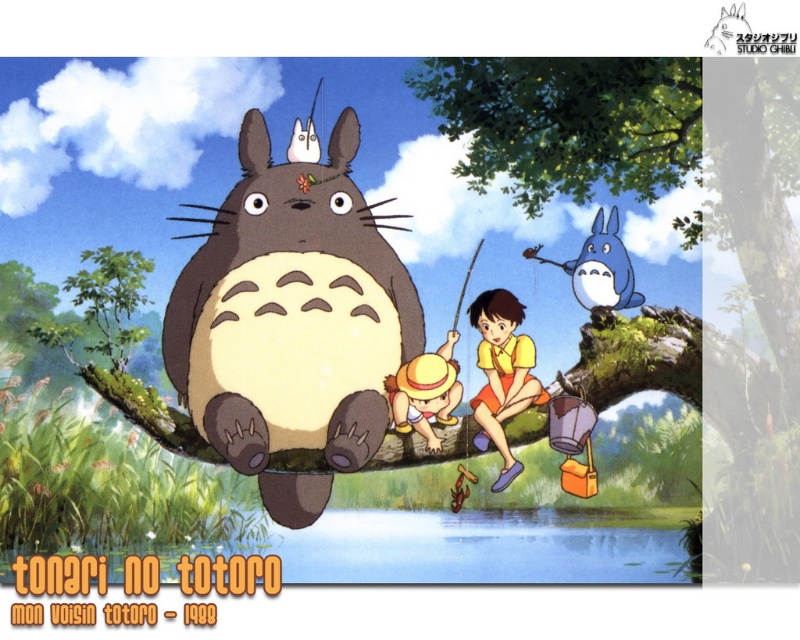
Is point (502, 348) in front of point (608, 218)?

Yes, it is.

Find the location of a particular element. yellow matte shorts at center is located at coordinates click(502, 374).

Can you confirm if brown fuzzy totoro at center is positioned to the right of yellow matte shorts at center?

Incorrect, brown fuzzy totoro at center is not on the right side of yellow matte shorts at center.

Between brown fuzzy totoro at center and yellow matte shorts at center, which one appears on the right side from the viewer's perspective?

yellow matte shorts at center is more to the right.

Does point (178, 218) lie in front of point (488, 420)?

No, (178, 218) is further to viewer.

In order to click on brown fuzzy totoro at center in this screenshot , I will do `click(292, 317)`.

Can you confirm if brown fuzzy totoro at center is thinner than blue matte totoro at upper center?

No.

Is brown fuzzy totoro at center above blue matte totoro at upper center?

Actually, brown fuzzy totoro at center is below blue matte totoro at upper center.

Is point (392, 252) farther from viewer compared to point (628, 282)?

No, it is in front of (628, 282).

This screenshot has width=800, height=640. I want to click on brown fuzzy totoro at center, so (292, 317).